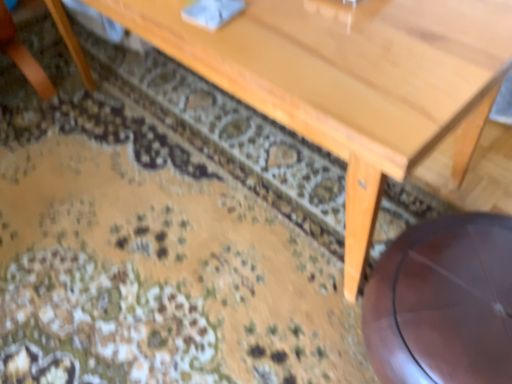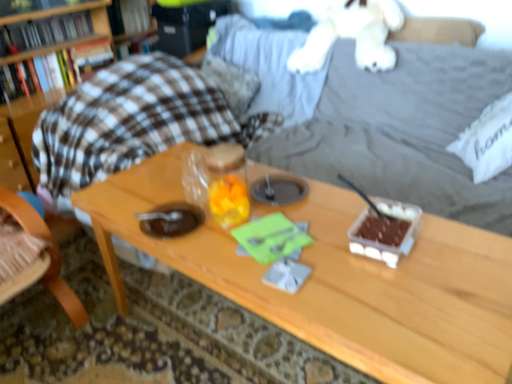
Question: Which way did the camera rotate in the video?

Choices:
 (A) rotated downward
 (B) rotated upward

Answer: (B)